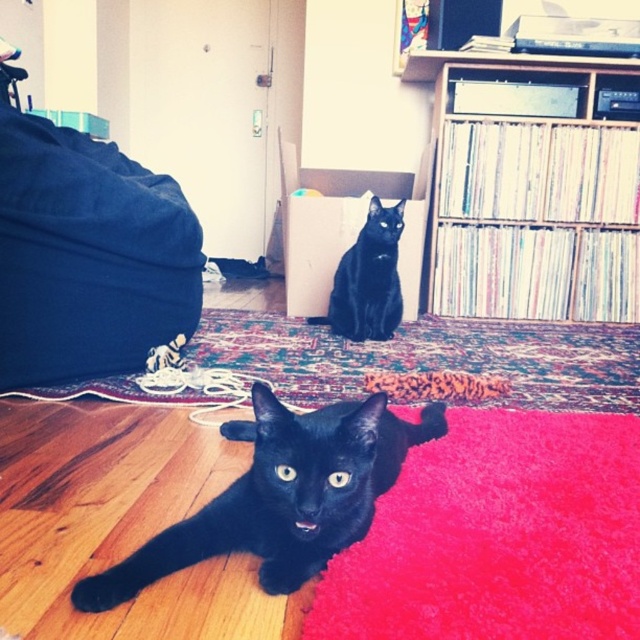
Does velvety pink rug at lower center appear on the left side of black matte cat at upper center?

Incorrect, velvety pink rug at lower center is not on the left side of black matte cat at upper center.

This screenshot has height=640, width=640. Find the location of `velvety pink rug at lower center`. velvety pink rug at lower center is located at coordinates (499, 536).

Between point (433, 468) and point (371, 230), which one is positioned in front?

Positioned in front is point (433, 468).

Where is `velvety pink rug at lower center`? This screenshot has height=640, width=640. velvety pink rug at lower center is located at coordinates (499, 536).

Between point (515, 70) and point (381, 257), which one is positioned behind?

The point (515, 70) is behind.

Does wooden vinyl records at upper right appear over black matte cat at upper center?

Yes, wooden vinyl records at upper right is above black matte cat at upper center.

Is point (536, 276) positioned after point (340, 316)?

That is True.

Identify the location of wooden vinyl records at upper right. This screenshot has height=640, width=640. (532, 200).

Is velvety pink rug at lower center positioned behind shiny black cat at lower left?

No, velvety pink rug at lower center is in front of shiny black cat at lower left.

The height and width of the screenshot is (640, 640). Describe the element at coordinates (499, 536) in the screenshot. I see `velvety pink rug at lower center` at that location.

The height and width of the screenshot is (640, 640). What do you see at coordinates (499, 536) in the screenshot?
I see `velvety pink rug at lower center` at bounding box center [499, 536].

This screenshot has width=640, height=640. I want to click on velvety pink rug at lower center, so click(x=499, y=536).